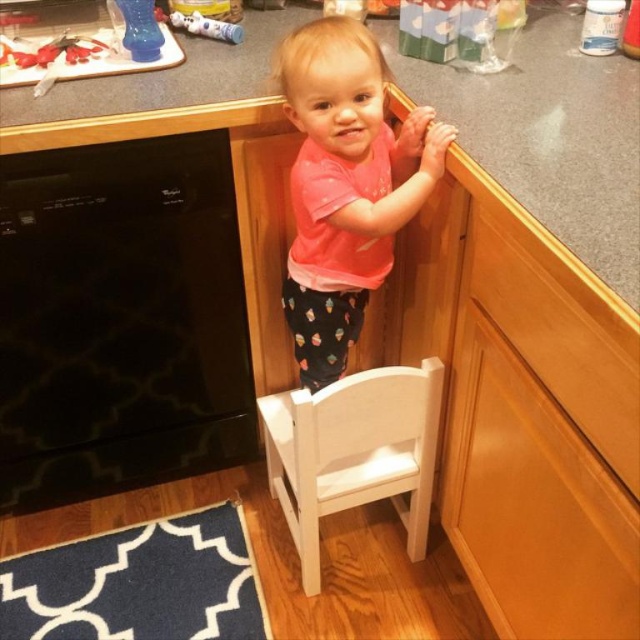
Which is above, gray matte counter top at upper center or pink matte shirt at center?

gray matte counter top at upper center is higher up.

Is gray matte counter top at upper center wider than pink matte shirt at center?

Yes, gray matte counter top at upper center is wider than pink matte shirt at center.

Locate an element on the screen. This screenshot has height=640, width=640. gray matte counter top at upper center is located at coordinates (548, 134).

Can you confirm if pink matte shirt at center is shorter than white wooden chair at lower center?

Incorrect, pink matte shirt at center's height does not fall short of white wooden chair at lower center's.

Can you confirm if pink matte shirt at center is positioned to the right of white wooden chair at lower center?

Yes, pink matte shirt at center is to the right of white wooden chair at lower center.

Is point (294, 300) positioned after point (358, 432)?

That is True.

Locate an element on the screen. pink matte shirt at center is located at coordinates (346, 186).

Is white wooden chair at lower center thinner than translucent plastic bottle at upper left?

No.

This screenshot has width=640, height=640. Describe the element at coordinates (353, 452) in the screenshot. I see `white wooden chair at lower center` at that location.

Where is `white wooden chair at lower center`? white wooden chair at lower center is located at coordinates (353, 452).